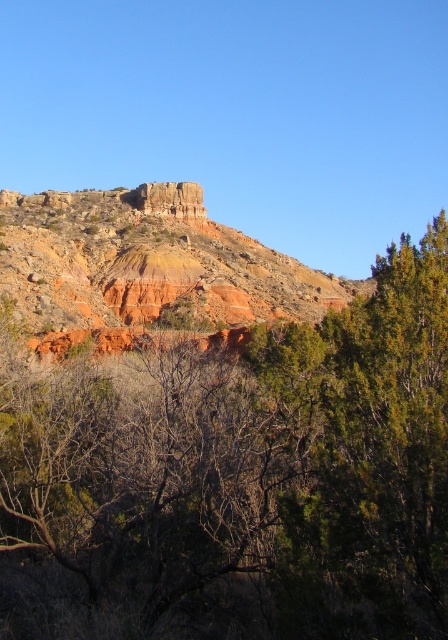
Question: Is green leafy tree at upper right bigger than rustic rock formation at center?

Choices:
 (A) no
 (B) yes

Answer: (A)

Question: From the image, what is the correct spatial relationship of green leafy tree at upper center in relation to rustic rock formation at center?

Choices:
 (A) above
 (B) below

Answer: (B)

Question: Which of the following is the farthest from the observer?

Choices:
 (A) rustic rock formation at center
 (B) green leafy tree at upper right
 (C) green leafy tree at upper center

Answer: (A)

Question: Which object appears farthest from the camera in this image?

Choices:
 (A) green leafy tree at upper right
 (B) rustic rock formation at center

Answer: (B)

Question: Which of the following is the closest to the observer?

Choices:
 (A) green leafy tree at upper center
 (B) rustic rock formation at center

Answer: (A)

Question: Is green leafy tree at upper center in front of green leafy tree at upper right?

Choices:
 (A) yes
 (B) no

Answer: (A)